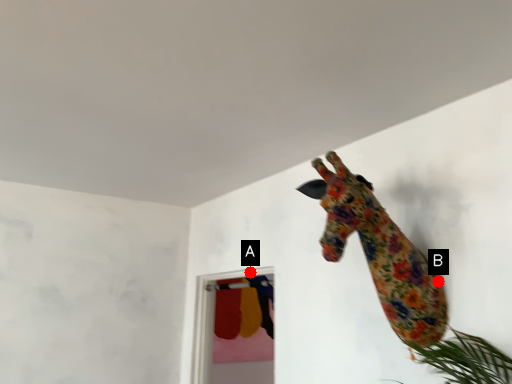
Question: Two points are circled on the image, labeled by A and B beside each circle. Which point is closer to the camera?

Choices:
 (A) A is closer
 (B) B is closer

Answer: (B)